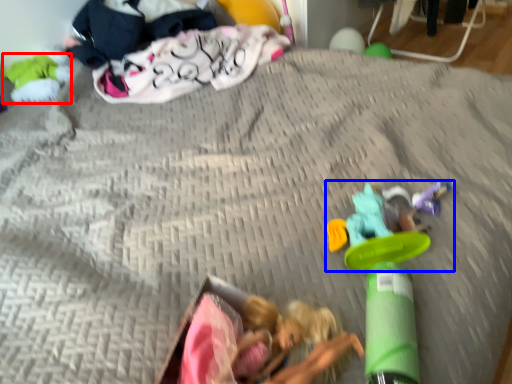
Question: Which of the following is the closest to the observer, toy (highlighted by a red box) or toy (highlighted by a blue box)?

Choices:
 (A) toy
 (B) toy

Answer: (B)